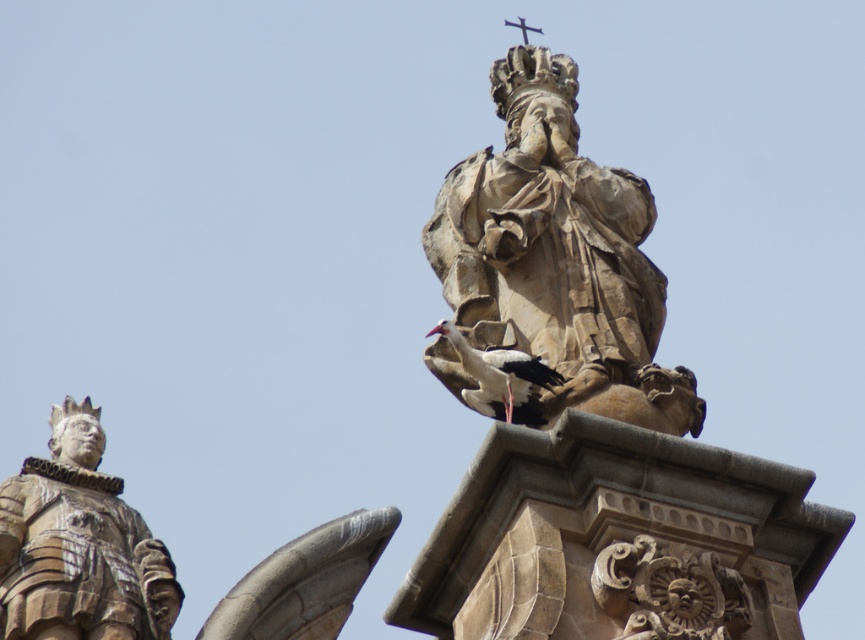
Is brown stone statue at center to the left of brown stone statue at left from the viewer's perspective?

No, brown stone statue at center is not to the left of brown stone statue at left.

Does brown stone statue at center appear over brown stone statue at left?

Yes.

Is point (537, 189) closer to camera compared to point (311, 544)?

Yes, it is in front of point (311, 544).

I want to click on brown stone statue at center, so click(x=558, y=257).

Does carved stone statue at left appear over white feathered bird at center?

No.

Consider the image. Who is shorter, carved stone statue at left or white feathered bird at center?

With less height is white feathered bird at center.

Does point (104, 632) lie in front of point (482, 412)?

No, (104, 632) is further to viewer.

The width and height of the screenshot is (865, 640). I want to click on carved stone statue at left, so click(78, 545).

Based on the photo, is brown stone statue at center positioned at the back of white feathered bird at center?

No.

Who is taller, brown stone statue at center or white feathered bird at center?

brown stone statue at center

Locate an element on the screen. This screenshot has height=640, width=865. brown stone statue at center is located at coordinates (558, 257).